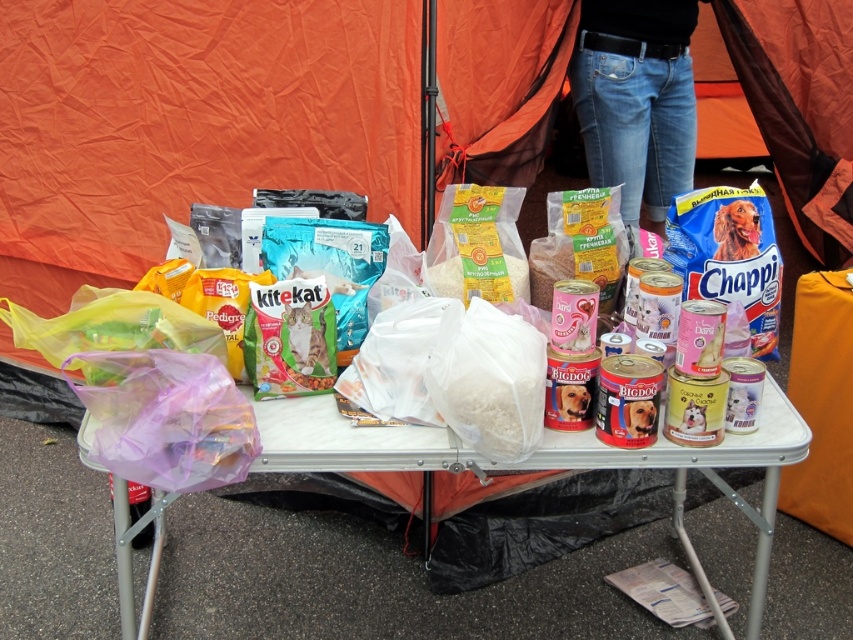
You are a volunteer at an outdoor pet food donation event. You need to place a new donation box that is 1.2 meters wide between the translucent plastic bag at lower left and the jeans at center. Will there be enough space to place the box without moving any existing items?

The distance between the translucent plastic bag at lower left and the jeans at center is 1.31 meters. Since the donation box is 1.2 meters wide, there is enough space to place it between them without moving existing items.

You are organizing a pet food drive and need to pack items into boxes. You have a translucent plastic bag at lower left and jeans at center. Which item can you fit into a standard shoebox size container?

The jeans at center can fit into a standard shoebox size container because the translucent plastic bag at lower left is bigger than jeans at center, making it too large for the shoebox.

You are a volunteer at a pet food distribution event. You need to place a 1.5 meter long banner on the table. The banner must be placed between the translucent plastic bag at lower left and the camera. Is there enough space for the banner?

The distance between the translucent plastic bag at lower left and the camera is 1.64 meters. Since the banner is 1.5 meters long, there is sufficient space to place it between them.